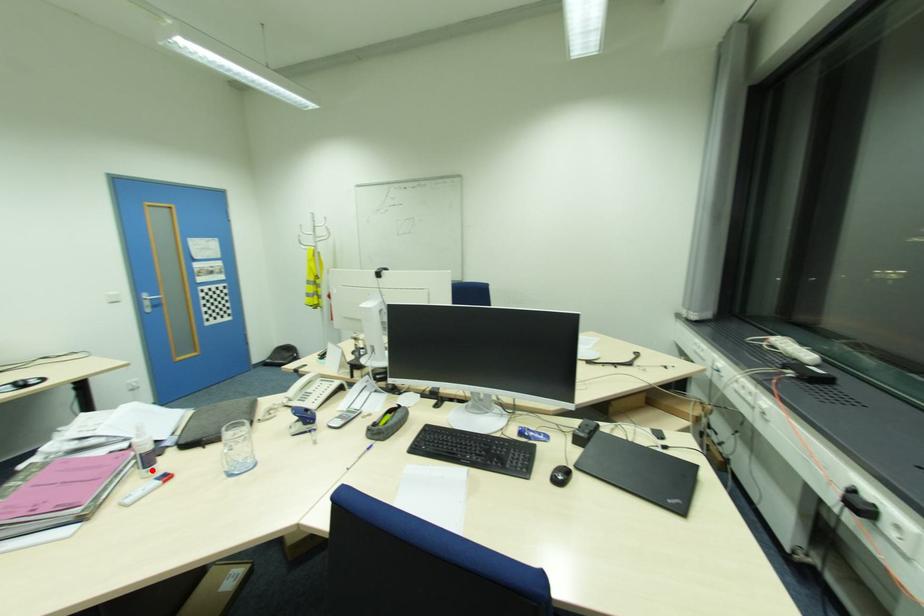
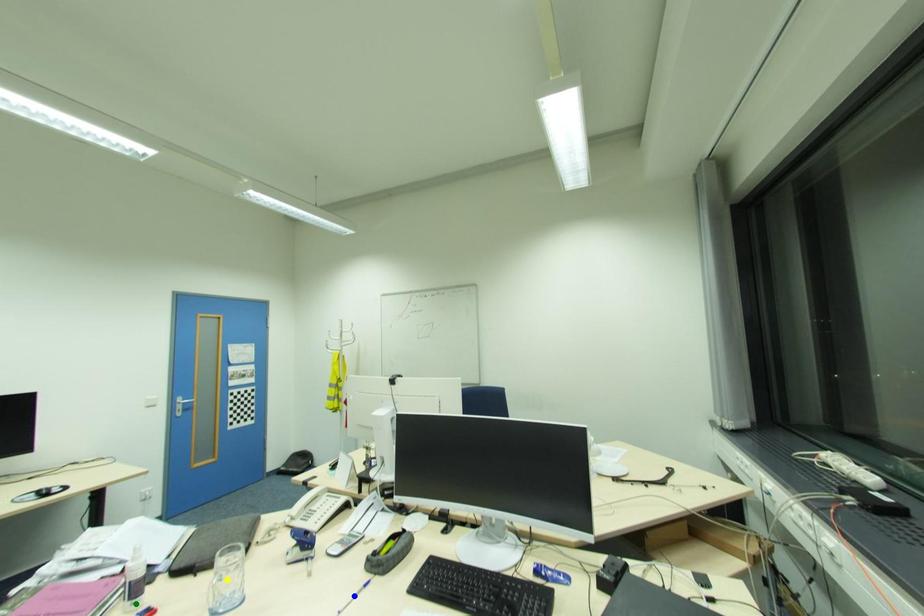
Question: I am providing you with two images of the same scene from different viewpoints. A red point is marked on the first image. You are given multiple points on the second image. Which mark in image 2 goes with the point in image 1?

Choices:
 (A) yellow point
 (B) blue point
 (C) green point

Answer: (C)